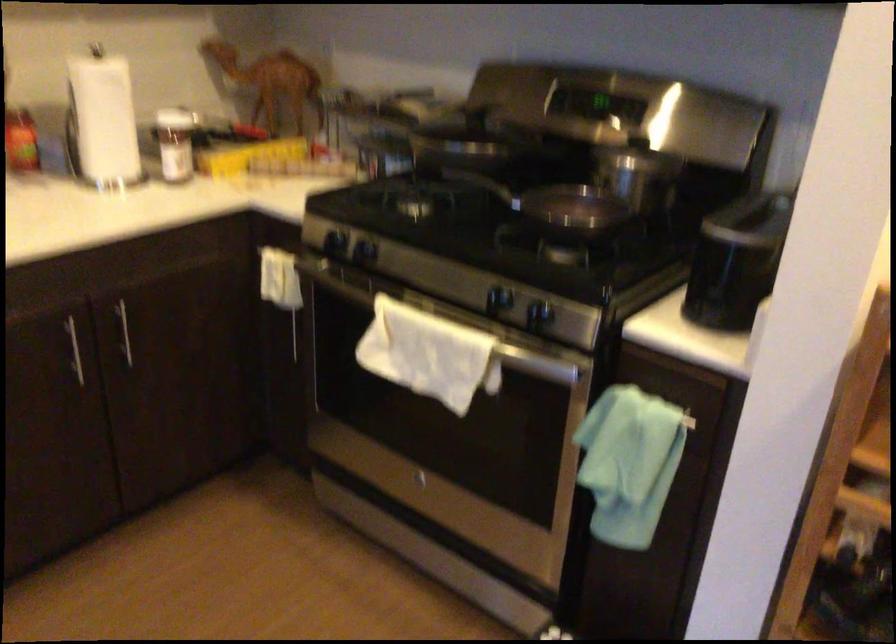
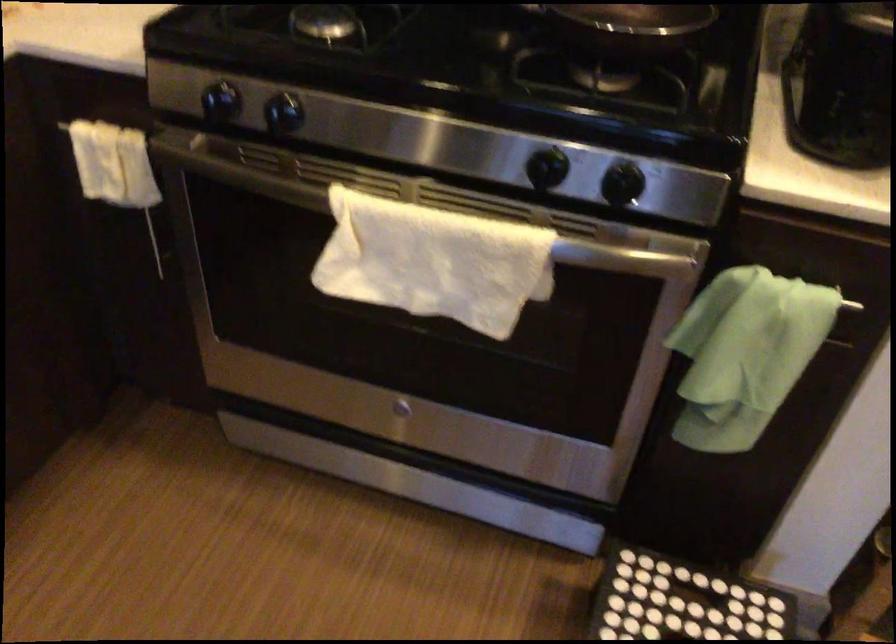
Where in the second image is the point corresponding to point 538,362 from the first image?

(618, 257)